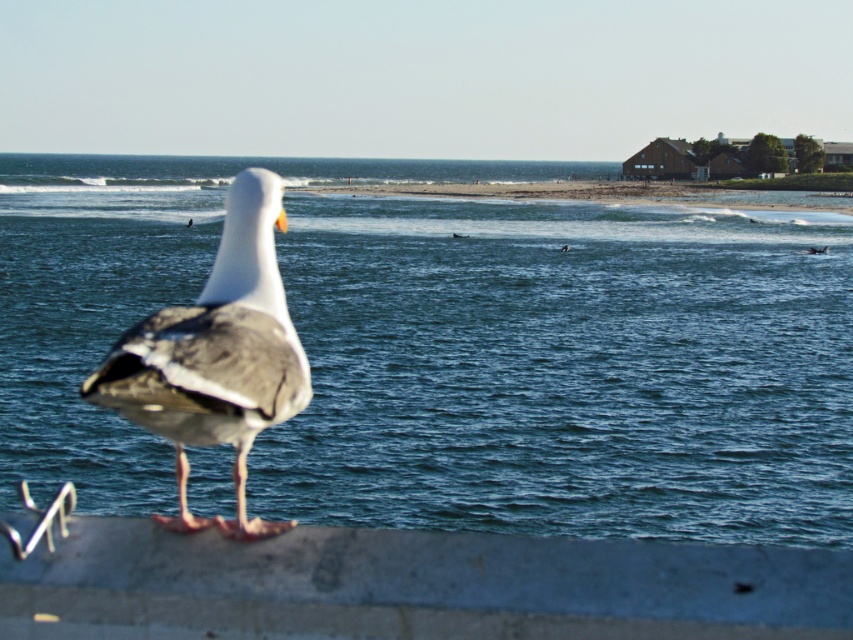
Can you confirm if blue water at center is smaller than gray concrete at lower center?

No.

Consider the image. Can you confirm if blue water at center is positioned to the right of gray concrete at lower center?

In fact, blue water at center is to the left of gray concrete at lower center.

Locate an element on the screen. The image size is (853, 640). blue water at center is located at coordinates (451, 352).

Who is positioned more to the left, gray concrete at lower center or white matte seagull at center?

From the viewer's perspective, white matte seagull at center appears more on the left side.

Is gray concrete at lower center further to camera compared to white matte seagull at center?

No, gray concrete at lower center is closer to the viewer.

In order to click on gray concrete at lower center in this screenshot , I will do `click(413, 586)`.

Locate an element on the screen. gray concrete at lower center is located at coordinates (413, 586).

What do you see at coordinates (451, 352) in the screenshot? This screenshot has height=640, width=853. I see `blue water at center` at bounding box center [451, 352].

Can you confirm if blue water at center is positioned below white matte seagull at center?

Incorrect, blue water at center is not positioned below white matte seagull at center.

Is point (840, 369) in front of point (258, 170)?

No.

Identify the location of blue water at center. (451, 352).